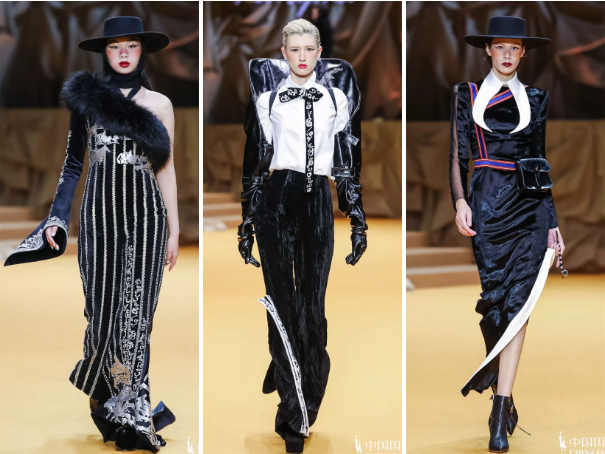
Locate an element on the screen. This screenshot has height=454, width=605. curtains is located at coordinates (36, 56).